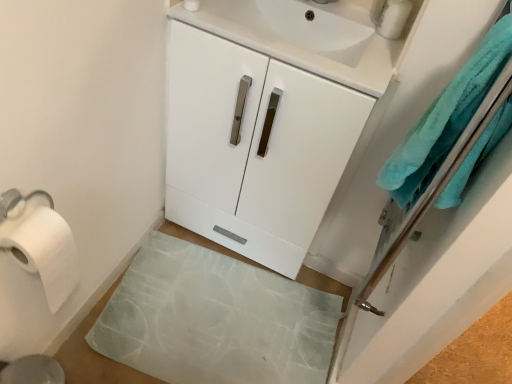
Question: Are teal soft towel at right and white glossy cabinet at center far apart?

Choices:
 (A) yes
 (B) no

Answer: (B)

Question: Does teal soft towel at right lie in front of white glossy cabinet at center?

Choices:
 (A) no
 (B) yes

Answer: (B)

Question: Considering the relative sizes of teal soft towel at right and white glossy cabinet at center in the image provided, is teal soft towel at right smaller than white glossy cabinet at center?

Choices:
 (A) yes
 (B) no

Answer: (A)

Question: From a real-world perspective, is teal soft towel at right located higher than white glossy cabinet at center?

Choices:
 (A) yes
 (B) no

Answer: (A)

Question: From a real-world perspective, is teal soft towel at right located beneath white glossy cabinet at center?

Choices:
 (A) yes
 (B) no

Answer: (B)

Question: Is point (335, 119) positioned closer to the camera than point (477, 87)?

Choices:
 (A) farther
 (B) closer

Answer: (A)

Question: Looking at the image, does white glossy cabinet at center seem bigger or smaller compared to teal soft towel at right?

Choices:
 (A) small
 (B) big

Answer: (B)

Question: From the image's perspective, is white glossy cabinet at center above or below teal soft towel at right?

Choices:
 (A) above
 (B) below

Answer: (A)

Question: In the image, is white glossy cabinet at center positioned in front of or behind teal soft towel at right?

Choices:
 (A) front
 (B) behind

Answer: (B)

Question: From the image's perspective, is white glossy sink at upper center positioned above or below metallic silver soap dispenser at upper right?

Choices:
 (A) below
 (B) above

Answer: (A)

Question: Looking at the image, does white glossy sink at upper center seem bigger or smaller compared to metallic silver soap dispenser at upper right?

Choices:
 (A) small
 (B) big

Answer: (B)

Question: From a real-world perspective, is white glossy sink at upper center above or below metallic silver soap dispenser at upper right?

Choices:
 (A) below
 (B) above

Answer: (A)

Question: Looking at their shapes, would you say white glossy sink at upper center is wider or thinner than metallic silver soap dispenser at upper right?

Choices:
 (A) wide
 (B) thin

Answer: (A)

Question: Choose the correct answer: Is white paper at left inside white glossy sink at upper center or outside it?

Choices:
 (A) outside
 (B) inside

Answer: (A)

Question: Is white paper at left bigger or smaller than white glossy sink at upper center?

Choices:
 (A) small
 (B) big

Answer: (A)